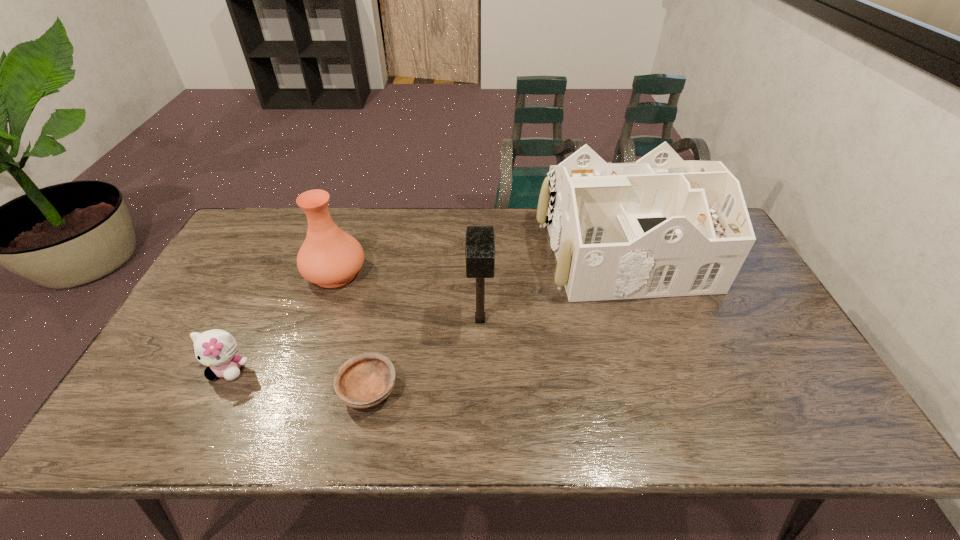
Locate an element on the screen. The width and height of the screenshot is (960, 540). dollhouse is located at coordinates (660, 227).

Find the location of a particular element. This screenshot has width=960, height=540. the second object from right to left is located at coordinates (480, 240).

You are a GUI agent. You are given a task and a screenshot of the screen. Output one action in this format:
    pyautogui.click(x=<x>, y=<y>)
    Task: Click on the mallet
    The height and width of the screenshot is (540, 960).
    Given the screenshot: What is the action you would take?
    (x=480, y=240)

Identify the location of vase. (329, 257).

Locate an element on the screen. The height and width of the screenshot is (540, 960). the fourth tallest object is located at coordinates (217, 349).

Identify the location of kitten. [x=217, y=349].

Where is `bowl`? bowl is located at coordinates (365, 380).

Find the location of `the shortest object`. the shortest object is located at coordinates (365, 380).

This screenshot has width=960, height=540. What are the coordinates of `free spot located on the left of the dollhouse` in the screenshot? It's located at (454, 252).

Where is `vacant space located on the front of the mallet`? The width and height of the screenshot is (960, 540). vacant space located on the front of the mallet is located at coordinates (480, 393).